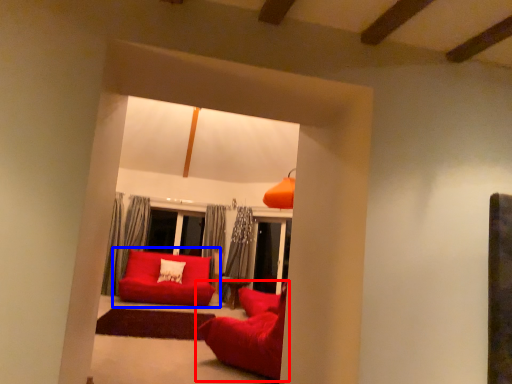
Question: Which object appears closest to the camera in this image, studio couch (highlighted by a red box) or studio couch (highlighted by a blue box)?

Choices:
 (A) studio couch
 (B) studio couch

Answer: (A)